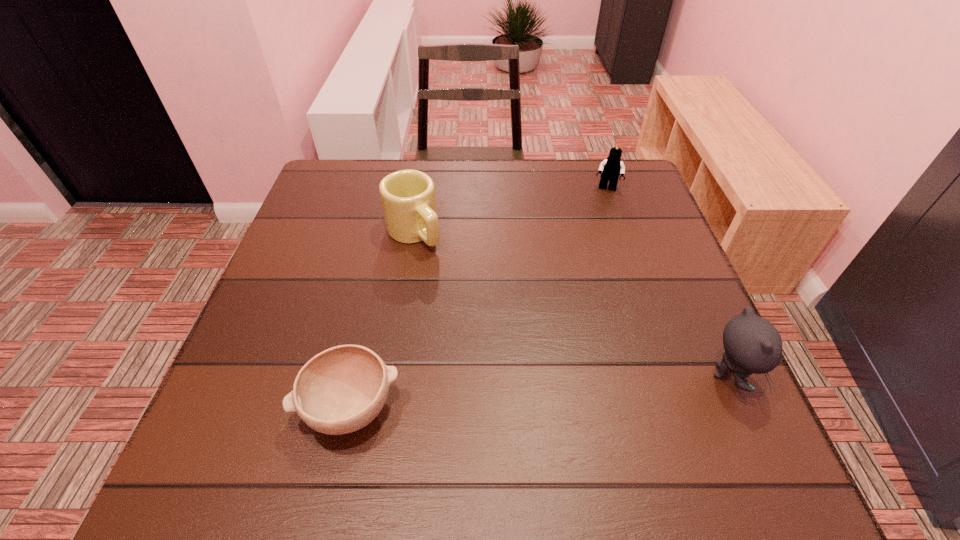
You are a GUI agent. You are given a task and a screenshot of the screen. Output one action in this format:
    pyautogui.click(x=<x>, y=<y>)
    Task: Click on the vacant position located 0.380m with the handle on the side of the mug
    The width and height of the screenshot is (960, 540).
    Given the screenshot: What is the action you would take?
    pyautogui.click(x=533, y=363)

Find the location of a particular element. Image resolution: width=960 pixels, height=540 pixels. vacant space located 0.220m with the handle on the side of the mug is located at coordinates pos(483,309).

The width and height of the screenshot is (960, 540). In order to click on object present at the far edge in this screenshot , I will do `click(611, 168)`.

Locate an element on the screen. bowl that is positioned at the near edge is located at coordinates (342, 389).

Where is `kitten that is at the near edge`? The width and height of the screenshot is (960, 540). kitten that is at the near edge is located at coordinates (752, 344).

Identify the location of object that is at the left edge. This screenshot has height=540, width=960. (342, 389).

The width and height of the screenshot is (960, 540). In order to click on kitten that is at the right edge in this screenshot , I will do tap(752, 344).

Image resolution: width=960 pixels, height=540 pixels. In order to click on Lego positioned at the right edge in this screenshot , I will do `click(611, 168)`.

Identify the location of object that is at the near left corner. (342, 389).

What are the coordinates of `object present at the far right corner` in the screenshot? It's located at tap(611, 168).